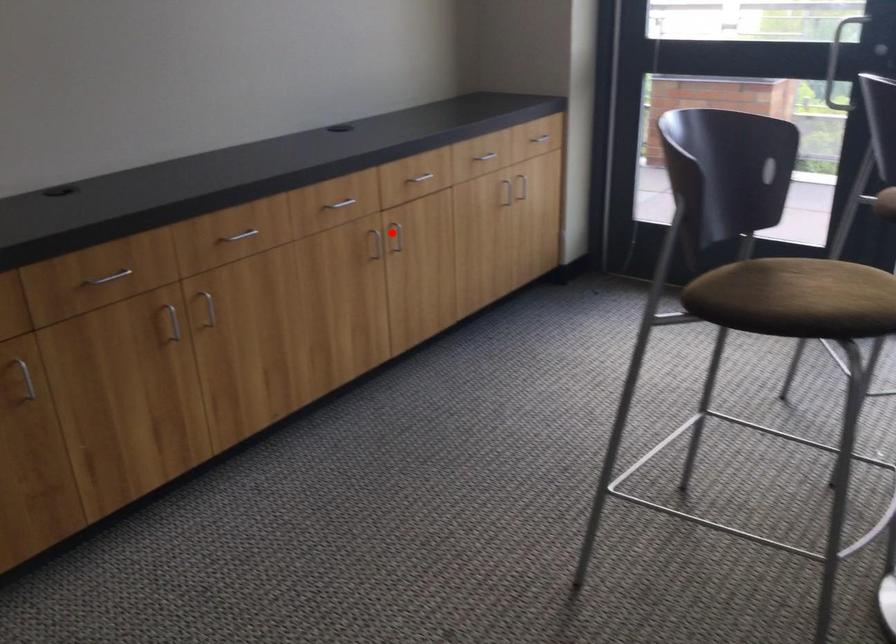
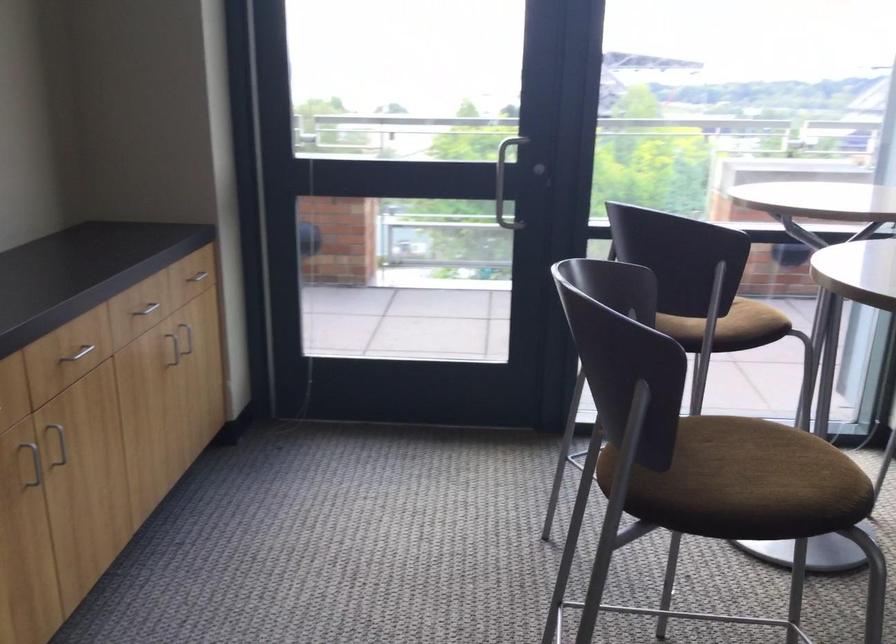
Question: A red point is marked in image1. In image2, is the corresponding 3D point closer to the camera or farther? Reply with the corresponding letter.

Choices:
 (A) The corresponding 3D point is closer.
 (B) The corresponding 3D point is farther.

Answer: (A)